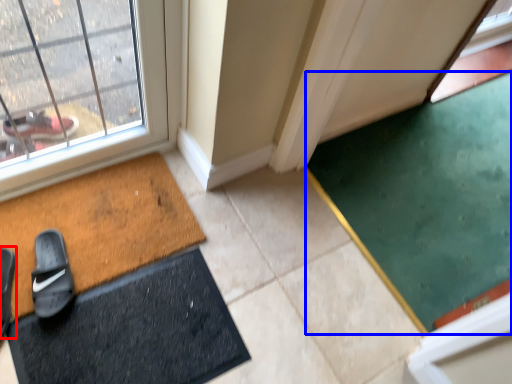
Question: Which point is closer to the camera, footwear (highlighted by a red box) or doormat (highlighted by a blue box)?

Choices:
 (A) footwear
 (B) doormat

Answer: (A)